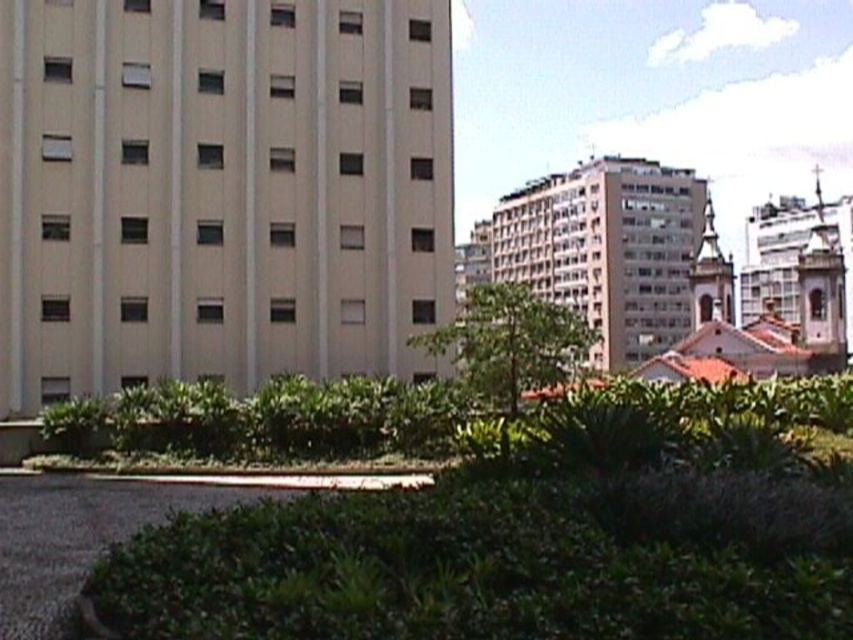
Between point (769, 268) and point (728, 314), which one is positioned behind?

Positioned behind is point (769, 268).

Can you confirm if white stone church at upper right is shorter than gold textured church steeple at upper right?

No, white stone church at upper right is not shorter than gold textured church steeple at upper right.

Describe the element at coordinates (799, 266) in the screenshot. I see `white stone church at upper right` at that location.

Where is `white stone church at upper right`? white stone church at upper right is located at coordinates (799, 266).

How far apart are beige smooth building at left and white stone church at upper right?

They are 76.61 meters apart.

Who is more distant from viewer, (149, 320) or (816, 339)?

Positioned behind is point (816, 339).

Between point (123, 337) and point (744, 323), which one is positioned behind?

The point (744, 323) is more distant.

What are the coordinates of `beige smooth building at left` in the screenshot? It's located at (219, 189).

Is point (297, 246) positioned behind point (563, 291)?

No.

Is beige smooth building at left thinner than beige textured building at center?

Correct, beige smooth building at left's width is less than beige textured building at center's.

Does point (229, 193) lie behind point (592, 209)?

No.

Where is `beige smooth building at left`? This screenshot has height=640, width=853. beige smooth building at left is located at coordinates (219, 189).